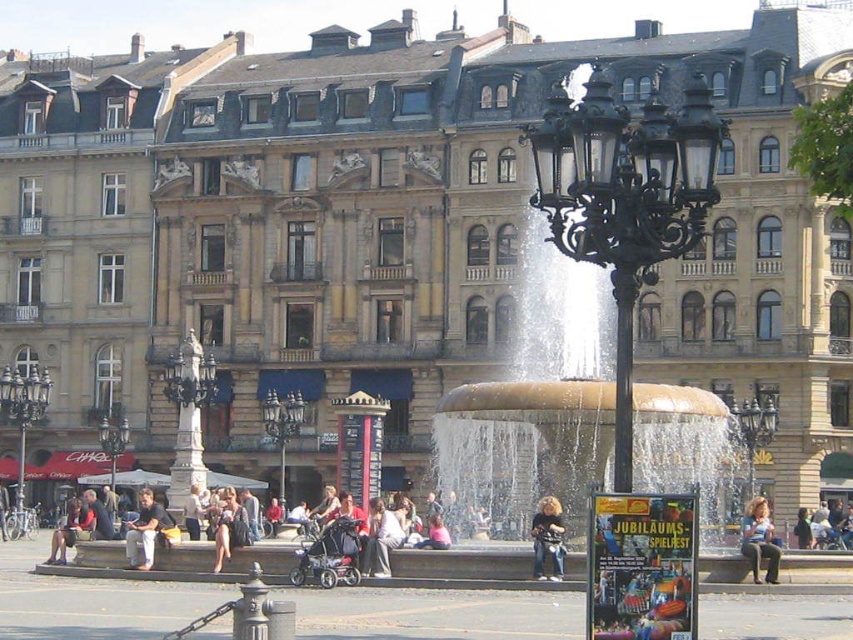
Is black wrought iron streetlight at center positioned at the back of dark gray fabric pants at lower left?

That is False.

Who is more distant from viewer, (633,156) or (164,536)?

Point (164,536)

Is point (701, 195) closer to camera compared to point (161, 529)?

Yes, point (701, 195) is in front of point (161, 529).

Find the location of a particular element. The height and width of the screenshot is (640, 853). black wrought iron streetlight at center is located at coordinates (624, 200).

Is dark brown leather jacket at center positioned behind light brown leather jacket at center?

No.

Can you confirm if dark brown leather jacket at center is positioned above light brown leather jacket at center?

No, dark brown leather jacket at center is not above light brown leather jacket at center.

Does point (556, 545) come farther from viewer compared to point (378, 547)?

No, (556, 545) is in front of (378, 547).

Locate an element on the screen. dark brown leather jacket at center is located at coordinates (548, 538).

Is gold polished water at center to the right of light brown leather jacket at lower right from the viewer's perspective?

Incorrect, gold polished water at center is not on the right side of light brown leather jacket at lower right.

Is gold polished water at center above light brown leather jacket at lower right?

Yes, gold polished water at center is above light brown leather jacket at lower right.

You are a GUI agent. You are given a task and a screenshot of the screen. Output one action in this format:
    pyautogui.click(x=<x>, y=<y>)
    Task: Click on the gold polished water at center
    
    Given the screenshot: What is the action you would take?
    pyautogui.click(x=537, y=403)

You are a GUI agent. You are given a task and a screenshot of the screen. Output one action in this format:
    pyautogui.click(x=<x>, y=<y>)
    Task: Click on the gold polished water at center
    The height and width of the screenshot is (640, 853).
    Given the screenshot: What is the action you would take?
    pyautogui.click(x=537, y=403)